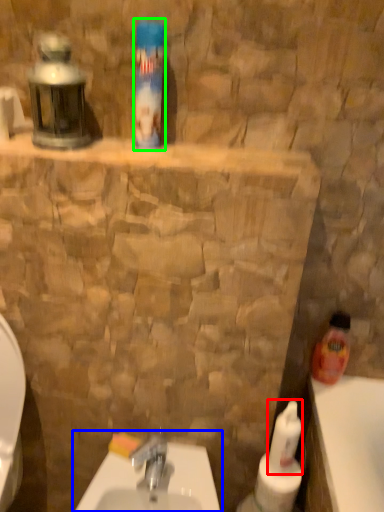
Question: Estimate the real-world distances between objects in this image. Which object is farther from cleaning product (highlighted by a red box), sink (highlighted by a blue box) or cleaning product (highlighted by a green box)?

Choices:
 (A) sink
 (B) cleaning product

Answer: (B)